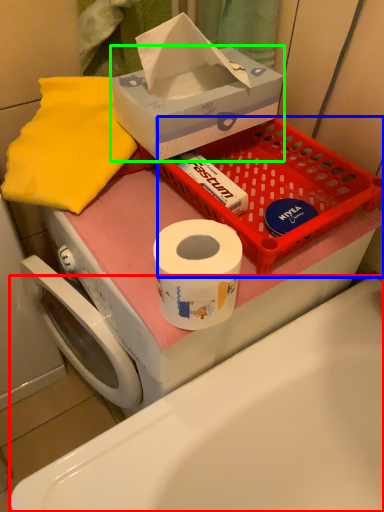
Question: Which is nearer to the bath (highlighted by a red box)? basket (highlighted by a blue box) or box (highlighted by a green box).

Choices:
 (A) basket
 (B) box

Answer: (A)